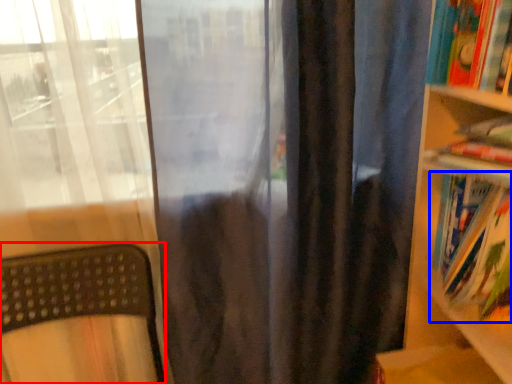
Question: Which object is closer to the camera taking this photo, furniture (highlighted by a red box) or book (highlighted by a blue box)?

Choices:
 (A) furniture
 (B) book

Answer: (A)